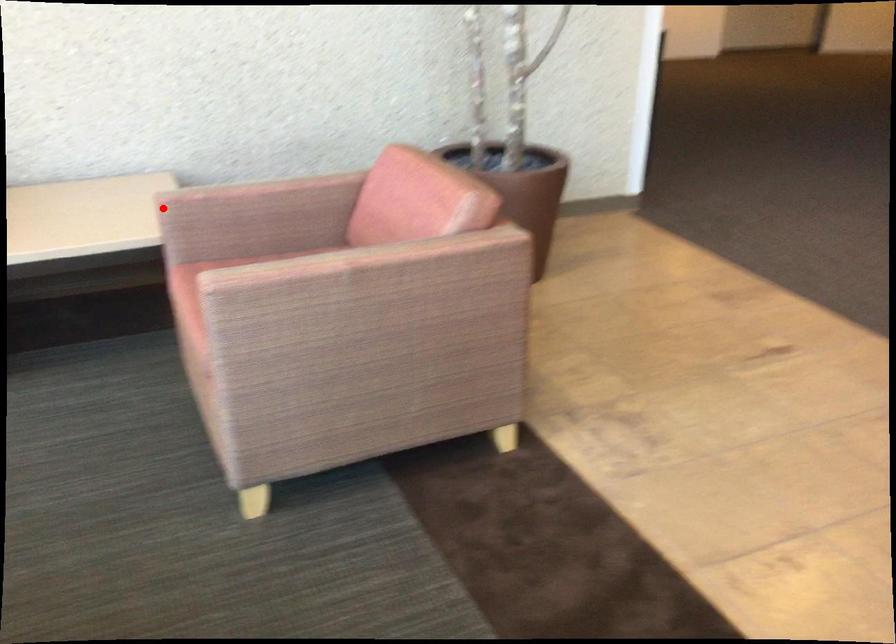
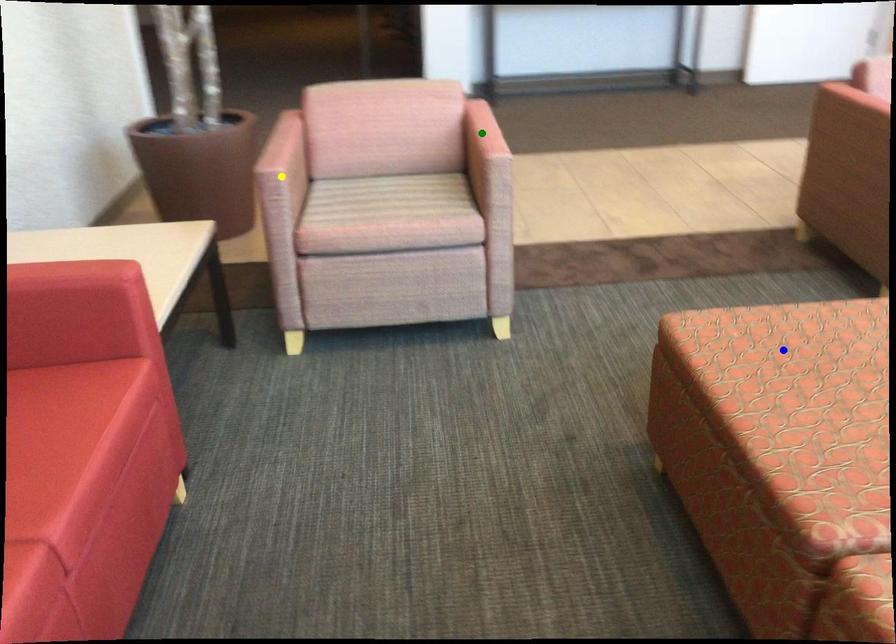
Question: I am providing you with two images of the same scene from different viewpoints. A red point is marked on the first image. You are given multiple points on the second image. Which point in image 2 represents the same 3d spot as the red point in image 1?

Choices:
 (A) blue point
 (B) green point
 (C) yellow point

Answer: (C)